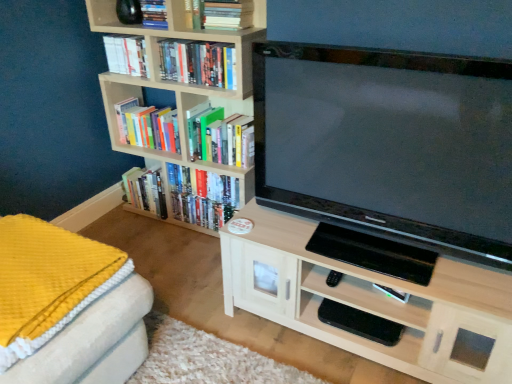
Find the location of `free space above hardcover books at upper center, the 4th book positioned from the top (from a real-world perspective)`. free space above hardcover books at upper center, the 4th book positioned from the top (from a real-world perspective) is located at coordinates (197, 43).